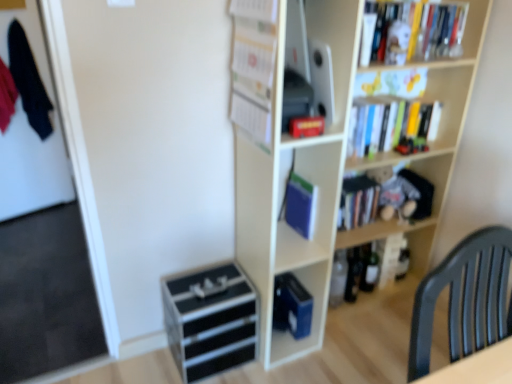
What are the coordinates of `blank space situated above hardcover book at center, which is the first book from back to front (from a real-world perspective)` in the screenshot? It's located at (356, 185).